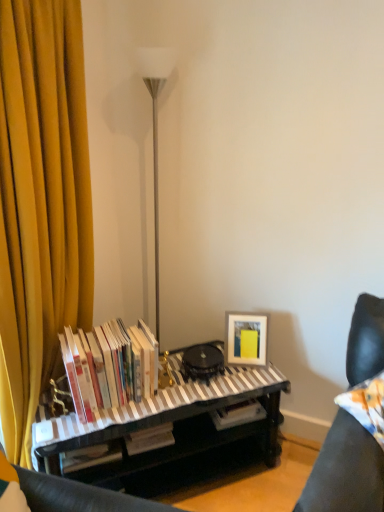
Question: From the image's perspective, is striped fabric piano at center located above or below matte white picture frame at lower right?

Choices:
 (A) below
 (B) above

Answer: (A)

Question: Is striped fabric piano at center in front of or behind matte white picture frame at lower right in the image?

Choices:
 (A) behind
 (B) front

Answer: (B)

Question: Which of these objects is positioned closest to the leather couch cushion at lower right?

Choices:
 (A) yellow fabric curtain at left
 (B) striped fabric piano at center
 (C) white paper book at left
 (D) matte white picture frame at lower right

Answer: (D)

Question: Estimate the real-world distances between objects in this image. Which object is closer to the leather couch cushion at lower right?

Choices:
 (A) yellow fabric curtain at left
 (B) striped fabric piano at center
 (C) matte white picture frame at lower right
 (D) white paper book at left

Answer: (C)